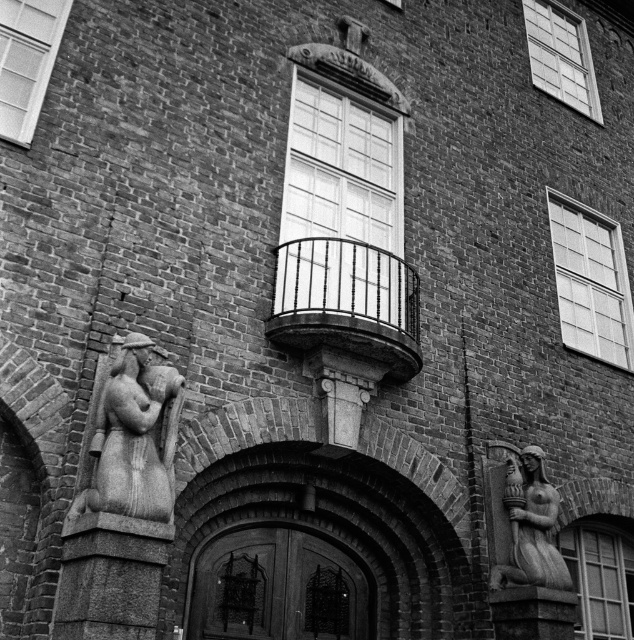
Question: Is carved stone couple at left wider than gray stone statue at lower right?

Choices:
 (A) yes
 (B) no

Answer: (A)

Question: Which object appears closest to the camera in this image?

Choices:
 (A) black wrought iron balcony at center
 (B) gray stone statue at lower right
 (C) carved stone couple at left

Answer: (C)

Question: Which object is positioned farthest from the black wrought iron balcony at center?

Choices:
 (A) gray stone statue at lower right
 (B) carved stone couple at left

Answer: (B)

Question: Does black wrought iron balcony at center have a smaller size compared to gray stone statue at lower right?

Choices:
 (A) no
 (B) yes

Answer: (A)

Question: Which point is closer to the camera taking this photo?

Choices:
 (A) (119, 394)
 (B) (534, 513)
 (C) (366, 323)

Answer: (A)

Question: Is black wrought iron balcony at center smaller than gray stone statue at lower right?

Choices:
 (A) yes
 (B) no

Answer: (B)